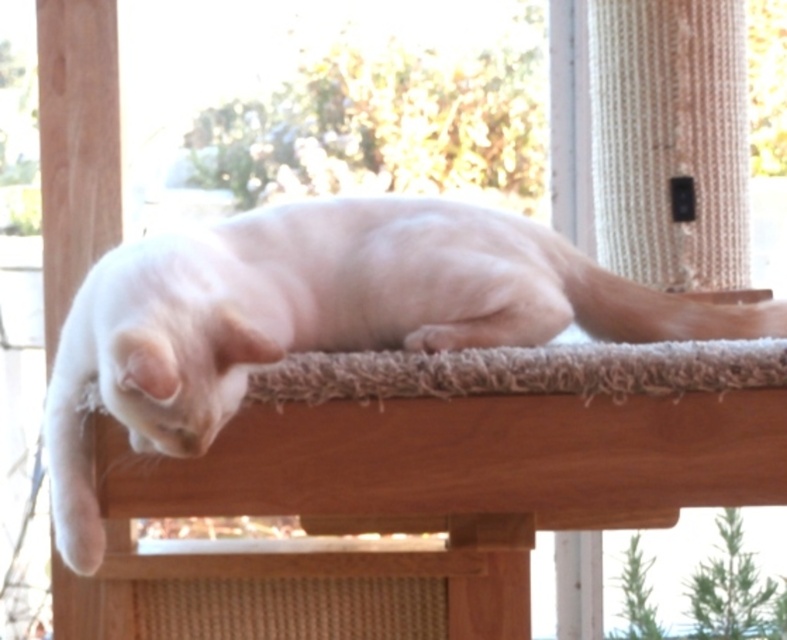
Does white fur cat at center have a larger size compared to shaggy beige carpet at center?

Indeed, white fur cat at center has a larger size compared to shaggy beige carpet at center.

Is point (497, 218) positioned after point (405, 388)?

Yes, it is behind point (405, 388).

The image size is (787, 640). What do you see at coordinates (320, 317) in the screenshot? I see `white fur cat at center` at bounding box center [320, 317].

You are a GUI agent. You are given a task and a screenshot of the screen. Output one action in this format:
    pyautogui.click(x=<x>, y=<y>)
    Task: Click on the white fur cat at center
    The width and height of the screenshot is (787, 640).
    Given the screenshot: What is the action you would take?
    pyautogui.click(x=320, y=317)